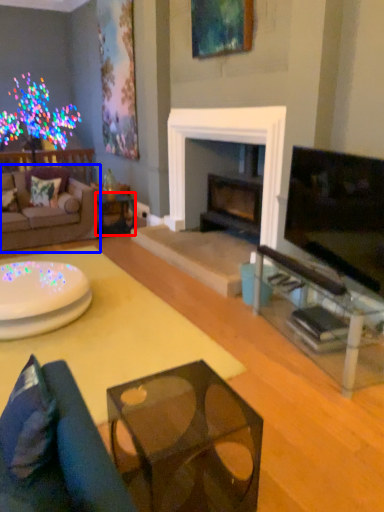
Question: Which point is further to the camera, side table (highlighted by a red box) or studio couch (highlighted by a blue box)?

Choices:
 (A) side table
 (B) studio couch

Answer: (A)